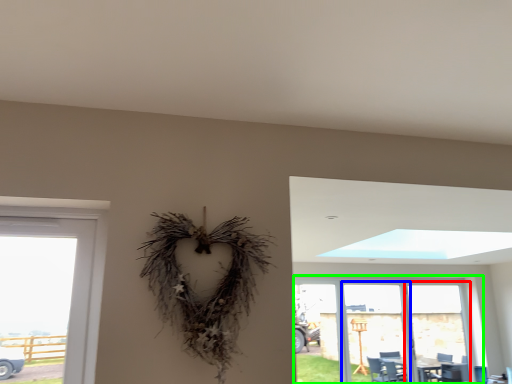
Question: Estimate the real-world distances between objects in this image. Which object is closer to screen door (highlighted by a red box), screen door (highlighted by a blue box) or window (highlighted by a green box)?

Choices:
 (A) screen door
 (B) window

Answer: (B)